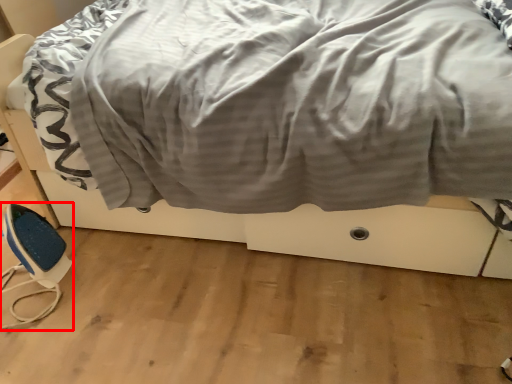
Question: From the image's perspective, where is equipment (annotated by the red box) located in relation to bed in the image?

Choices:
 (A) below
 (B) above

Answer: (A)